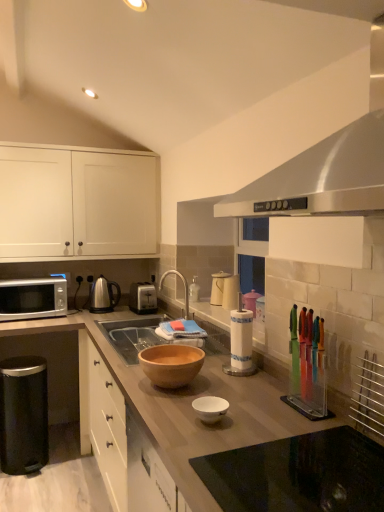
Image resolution: width=384 pixels, height=512 pixels. In order to click on vacant region in front of black matte trash can at lower left, positioned as the 1th appliance in left-to-right order in this screenshot , I will do `click(31, 487)`.